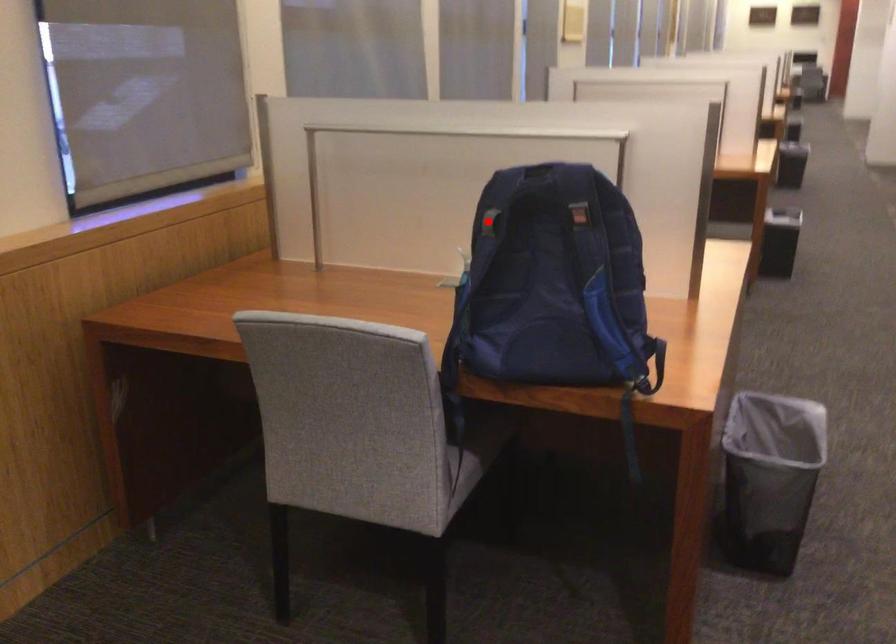
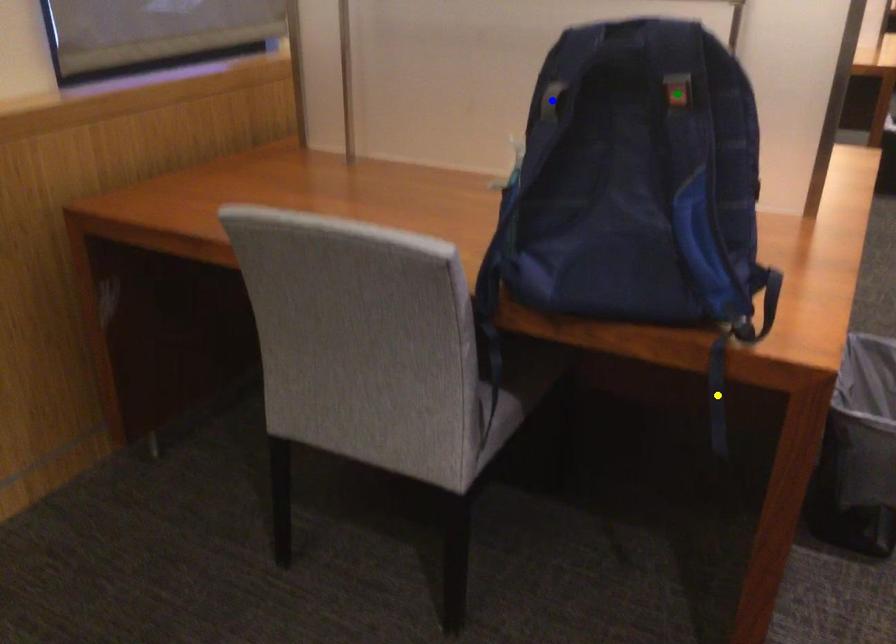
Question: I am providing you with two images of the same scene from different viewpoints. A red point is marked on the first image. You are given multiple points on the second image. In image 2, which mark is for the same physical point as the one in image 1?

Choices:
 (A) blue point
 (B) green point
 (C) yellow point

Answer: (A)